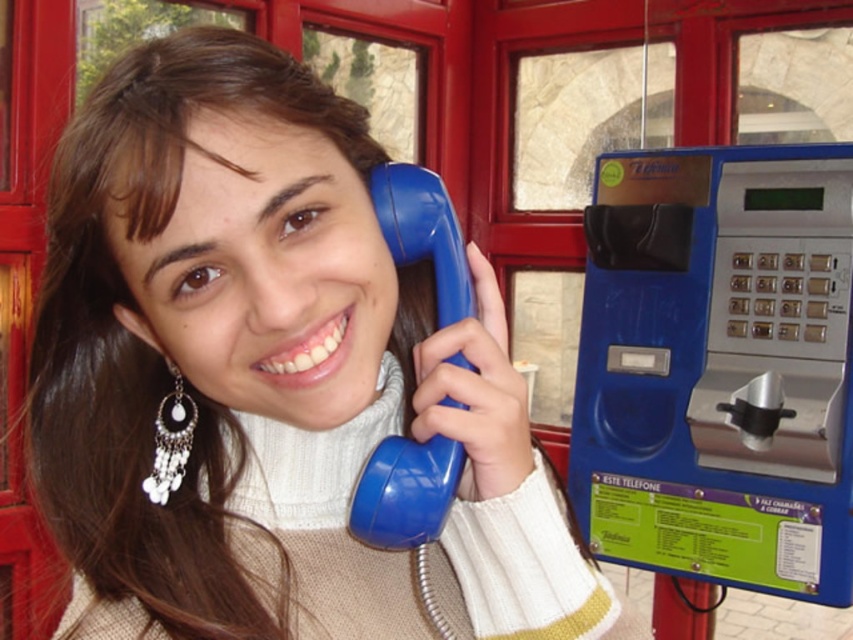
Between matte blue phone at center and silver/glass earrings at lower left, which one appears on the right side from the viewer's perspective?

matte blue phone at center is more to the right.

Can you confirm if matte blue phone at center is positioned above silver/glass earrings at lower left?

Incorrect, matte blue phone at center is not positioned above silver/glass earrings at lower left.

Where is `matte blue phone at center`? This screenshot has width=853, height=640. matte blue phone at center is located at coordinates (270, 376).

Locate an element on the screen. The height and width of the screenshot is (640, 853). matte blue phone at center is located at coordinates (270, 376).

Does point (173, 536) come farther from viewer compared to point (757, 401)?

No.

Does point (230, 276) come in front of point (828, 392)?

Yes.

I want to click on matte blue phone at center, so click(x=270, y=376).

In the scene shown: Does blue plastic phone box at right have a lesser height compared to silver/glass earrings at lower left?

No.

Is blue plastic phone box at right thinner than silver/glass earrings at lower left?

No.

This screenshot has height=640, width=853. I want to click on blue plastic phone box at right, so click(718, 368).

Locate an element on the screen. blue plastic phone box at right is located at coordinates (718, 368).